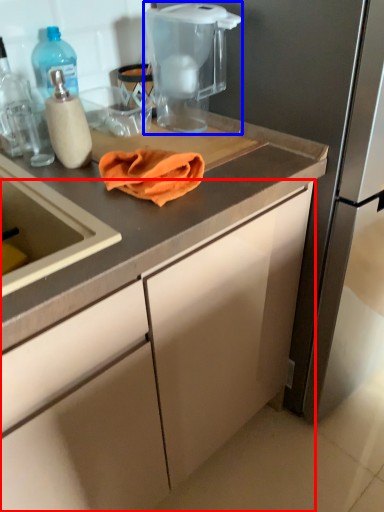
Question: Which object is further to the camera taking this photo, cabinetry (highlighted by a red box) or home appliance (highlighted by a blue box)?

Choices:
 (A) cabinetry
 (B) home appliance

Answer: (B)